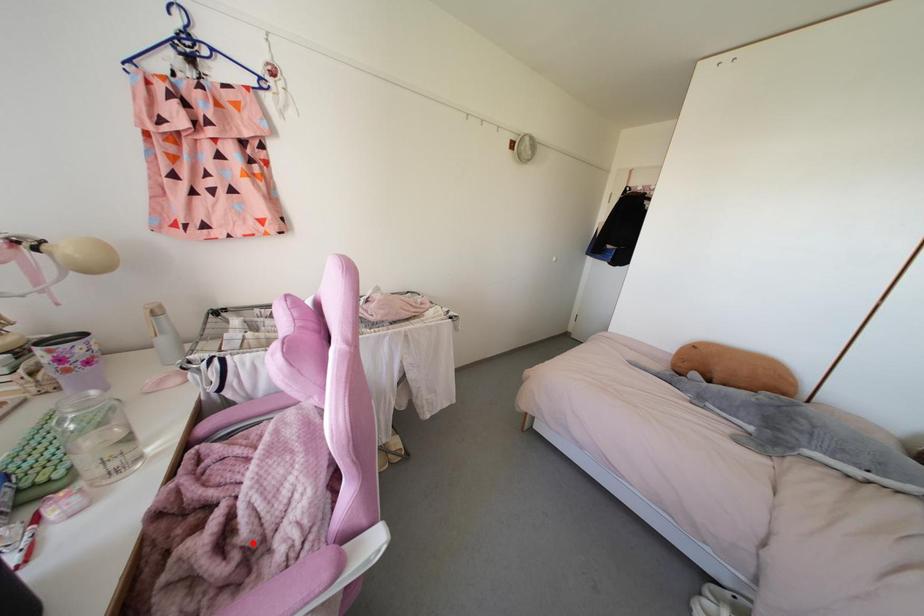
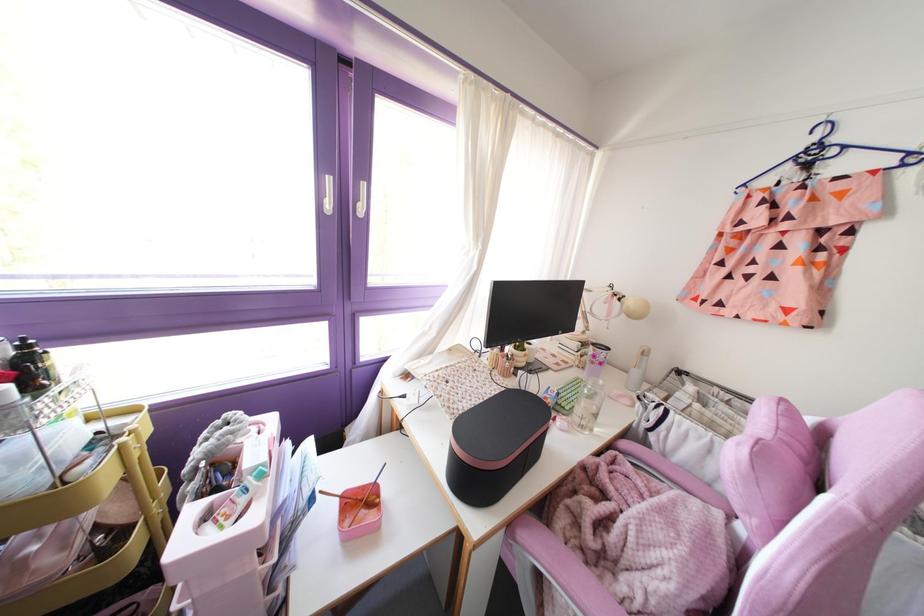
In the second image, find the point that corresponds to the highlighted location in the first image.

(610, 553)